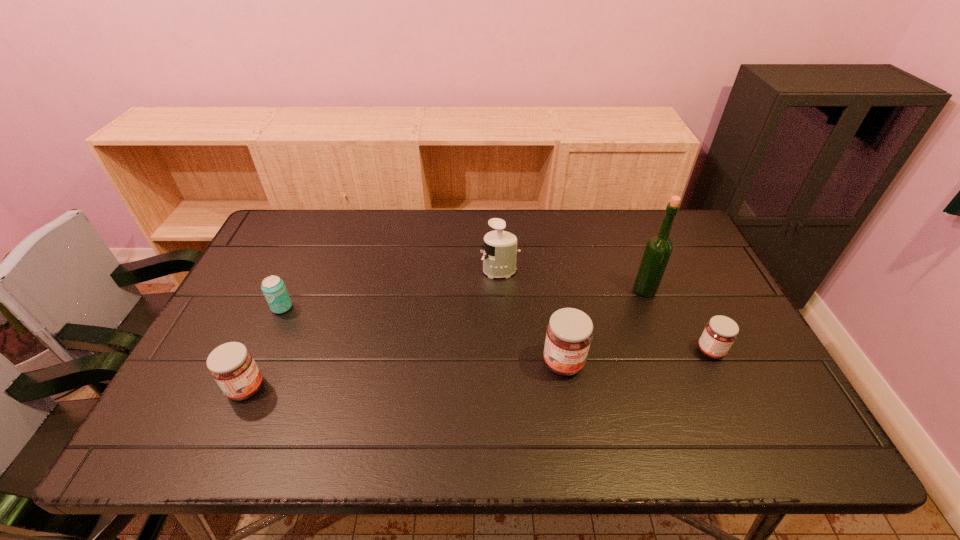
Find the location of a particular element. This screenshot has width=960, height=540. the leftmost jam is located at coordinates (232, 366).

At what (x,y) coordinates should I click in order to perform the action: click on the fourth tallest object. Please return your answer as a coordinate pair (x, y). This screenshot has height=540, width=960. Looking at the image, I should click on (232, 366).

Locate an element on the screen. Image resolution: width=960 pixels, height=540 pixels. the tallest jam is located at coordinates (569, 334).

This screenshot has width=960, height=540. Find the location of `the fourth object from left to right`. the fourth object from left to right is located at coordinates (569, 334).

Locate an element on the screen. the rightmost jam is located at coordinates (720, 332).

Find the location of `the shortest jam`. the shortest jam is located at coordinates (720, 332).

Locate an element on the screen. The height and width of the screenshot is (540, 960). beer can is located at coordinates (273, 287).

You are a GUI agent. You are given a task and a screenshot of the screen. Output one action in this format:
    pyautogui.click(x=<x>, y=<y>)
    Task: Click on the tallest object
    
    Given the screenshot: What is the action you would take?
    pyautogui.click(x=658, y=250)

In order to click on the second object from right to left in this screenshot , I will do `click(658, 250)`.

This screenshot has width=960, height=540. I want to click on juicer, so click(499, 257).